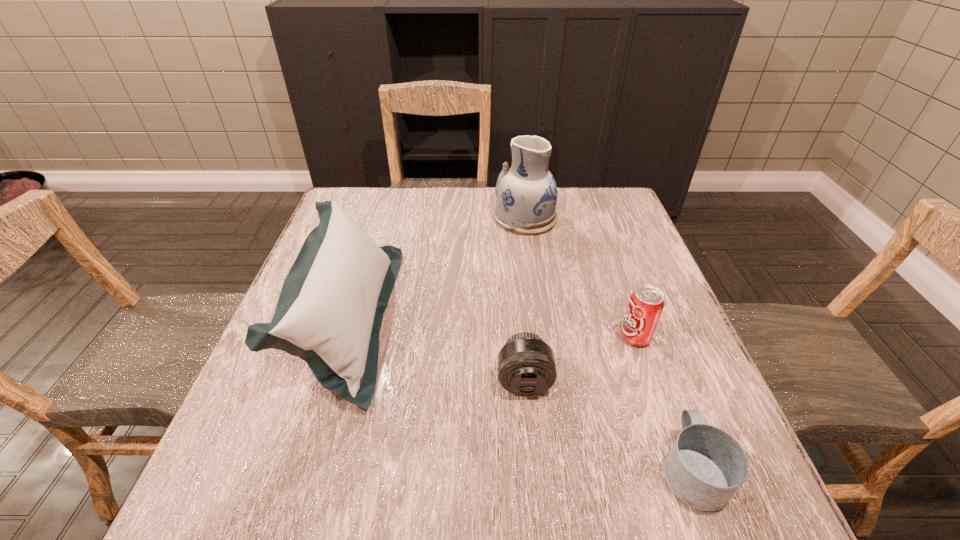
Find the location of `vacant point located between the farthest object and the shortest object`. vacant point located between the farthest object and the shortest object is located at coordinates (609, 343).

Where is `free space between the soda and the farthest object`? free space between the soda and the farthest object is located at coordinates (580, 278).

At what (x,y) coordinates should I click in order to perform the action: click on vacant area that lies between the fourth shortest object and the tallest object. Please return your answer as a coordinate pair (x, y). Looking at the image, I should click on (437, 268).

Where is `free space between the soda and the telephoto lens`? This screenshot has width=960, height=540. free space between the soda and the telephoto lens is located at coordinates (580, 359).

You are a GUI agent. You are given a task and a screenshot of the screen. Output one action in this format:
    pyautogui.click(x=<x>, y=<y>)
    Task: Click on the empty space between the third tallest object and the fourth shortest object
    The width and height of the screenshot is (960, 540).
    Given the screenshot: What is the action you would take?
    pyautogui.click(x=492, y=328)

I want to click on free point between the nearest object and the tallest object, so click(609, 343).

Locate an element on the screen. This screenshot has height=540, width=960. object that stands as the second closest to the third shortest object is located at coordinates (705, 467).

Point out which object is positioned as the third nearest to the mug. Please provide its 2D coordinates. Your answer should be formatted as a tuple, i.e. [(x, y)], where the tuple contains the x and y coordinates of a point satisfying the conditions above.

[(330, 310)]

This screenshot has height=540, width=960. Identify the location of free space that satisfies the following two spatial constraints: 1. on the surface of the cushion; 2. on the side of the nearest object with the handle. (302, 468).

Where is `vacant region that satisfies the following two spatial constraints: 1. on the surface of the leftmost object; 2. on the side of the nearest object with the handle`? Image resolution: width=960 pixels, height=540 pixels. vacant region that satisfies the following two spatial constraints: 1. on the surface of the leftmost object; 2. on the side of the nearest object with the handle is located at coordinates (302, 468).